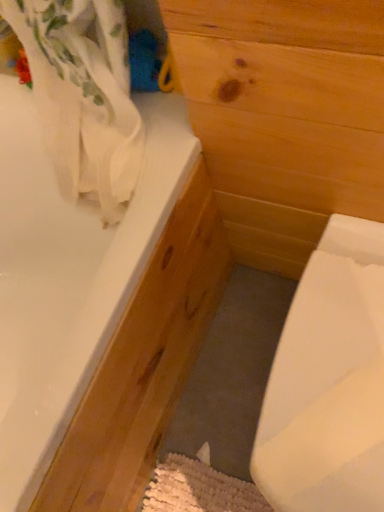
Question: Is the position of white glossy bathtub at upper left less distant than that of white glossy sink at lower right?

Choices:
 (A) yes
 (B) no

Answer: (A)

Question: Could you tell me if white glossy bathtub at upper left is facing white glossy sink at lower right?

Choices:
 (A) no
 (B) yes

Answer: (B)

Question: Can white glossy sink at lower right be found inside white glossy bathtub at upper left?

Choices:
 (A) no
 (B) yes

Answer: (A)

Question: Is white glossy bathtub at upper left smaller than white glossy sink at lower right?

Choices:
 (A) yes
 (B) no

Answer: (B)

Question: Is the position of white glossy bathtub at upper left more distant than that of white glossy sink at lower right?

Choices:
 (A) no
 (B) yes

Answer: (A)

Question: Does white glossy bathtub at upper left have a larger size compared to white glossy sink at lower right?

Choices:
 (A) yes
 (B) no

Answer: (A)

Question: Can you confirm if white glossy sink at lower right is taller than white glossy bathtub at upper left?

Choices:
 (A) no
 (B) yes

Answer: (A)

Question: Is white glossy sink at lower right positioned beyond the bounds of white glossy bathtub at upper left?

Choices:
 (A) no
 (B) yes

Answer: (B)

Question: Could you tell me if white glossy sink at lower right is turned towards white glossy bathtub at upper left?

Choices:
 (A) yes
 (B) no

Answer: (B)

Question: Does white glossy sink at lower right have a larger size compared to white glossy bathtub at upper left?

Choices:
 (A) no
 (B) yes

Answer: (A)

Question: Does white glossy sink at lower right have a lesser height compared to white glossy bathtub at upper left?

Choices:
 (A) no
 (B) yes

Answer: (B)

Question: Is white glossy sink at lower right further to camera compared to white glossy bathtub at upper left?

Choices:
 (A) no
 (B) yes

Answer: (B)

Question: Do you think white glossy sink at lower right is within white glossy bathtub at upper left, or outside of it?

Choices:
 (A) outside
 (B) inside

Answer: (A)